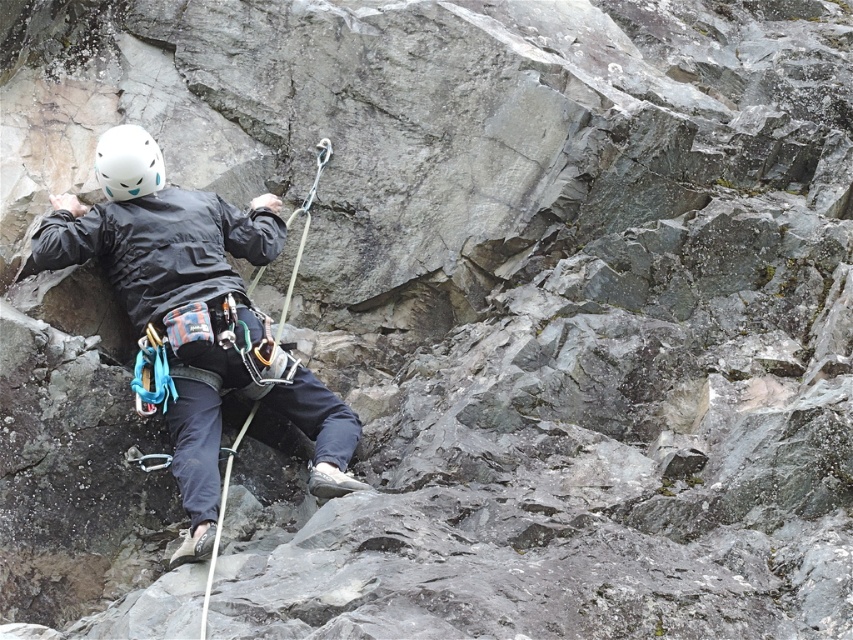
Consider the image. You are a rock climber preparing to adjust your gear. You have a tool that can only reach items wider than 30 cm. Looking at the scene, will your tool be able to reach the matte black jacket at center and the white matte helmet at upper left?

The matte black jacket at center has a width less than the white matte helmet at upper left. Since the tool requires items wider than 30 cm, and the jacket is narrower than the helmet, only the white matte helmet at upper left might be reachable if its width exceeds 30 cm. However, without knowing the exact width of the helmet, we cannot confirm for certain. But based on the given information, the jacket is definitely too narrow, while the helmet could potentially be wide enough depending on its actual size

You are a rock climbing instructor observing a climber. You notice the matte black jacket at center and the white matte helmet at upper left. Which object takes up more area in the image?

The white matte helmet at upper left takes up more area than the matte black jacket at center.

You are a rock climber looking at the cliff face. There are two points marked on the rock face at coordinates point (350, 412) and point (100, 164). Which point is closer to you?

Point (350, 412) is closer to the viewer than point (100, 164).